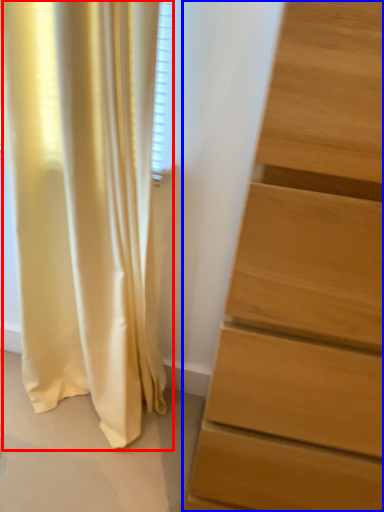
Question: Which object appears closest to the camera in this image, curtain (highlighted by a red box) or chest of drawers (highlighted by a blue box)?

Choices:
 (A) curtain
 (B) chest of drawers

Answer: (B)